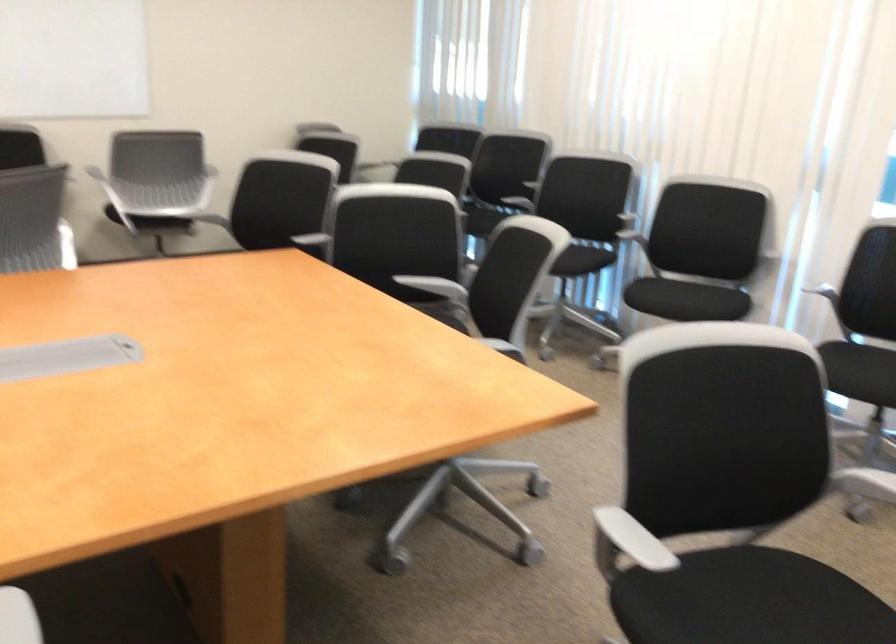
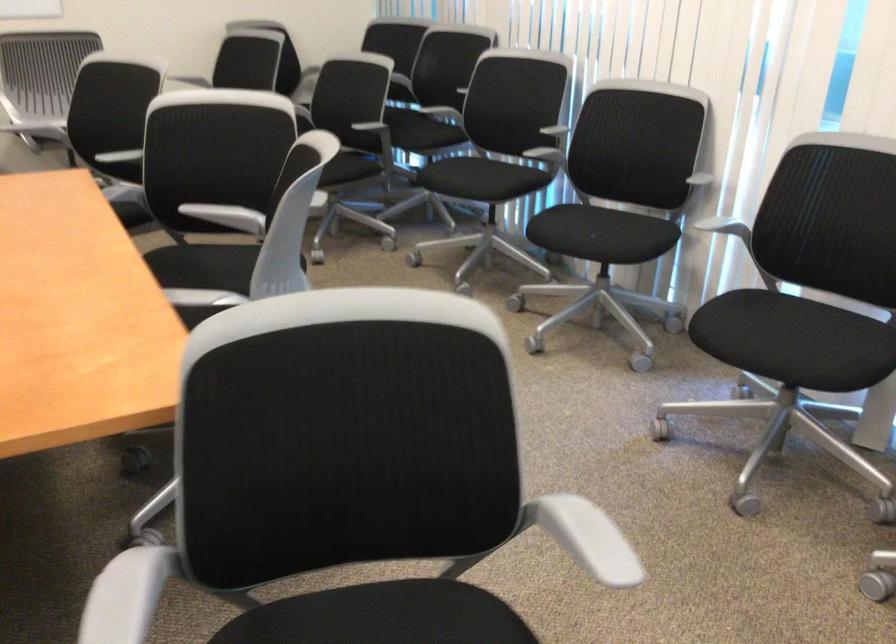
Question: The first image is from the beginning of the video and the second image is from the end. How did the camera likely rotate when shooting the video?

Choices:
 (A) Left
 (B) Right
 (C) Up
 (D) Down

Answer: (D)